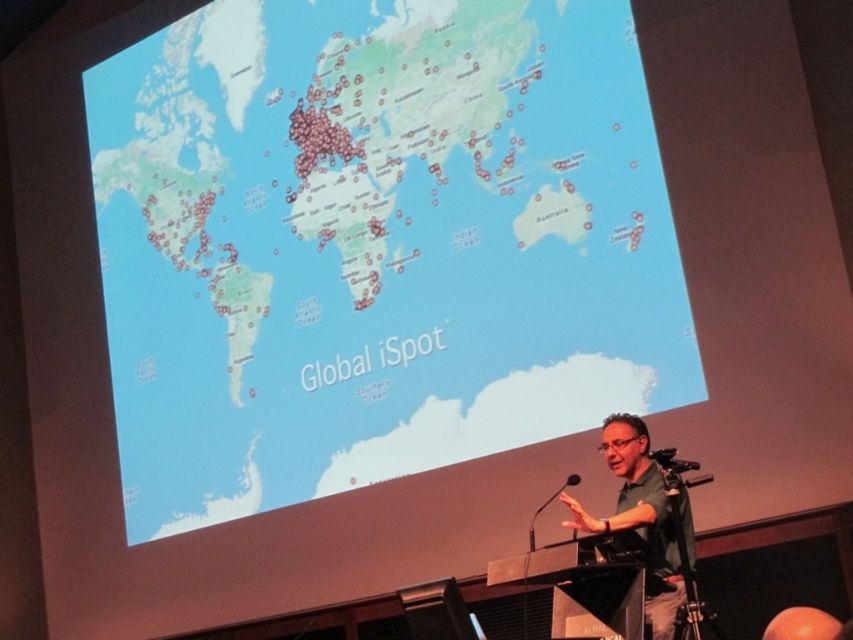
You are standing at the front of the room and need to adjust the volume of the black plastic speaker at lower center. Based on its position, where should you move to reach it?

The black plastic speaker at lower center is located at point [438,611], so you should move towards the lower center area of the room to reach it.

In the scene shown: You are an attendee at the presentation and want to ask a question. You need to walk from your seat to the podium. Which object, the green fabric shirt at lower right or the black plastic microphone at lower center, will you see first as you approach the podium from the audience side?

The green fabric shirt at lower right is positioned on the right side of the black plastic microphone at lower center, so you will see the black plastic microphone at lower center first as you approach the podium from the audience side.

You are an attendee at the presentation and want to move from your seat to the orange matte ball at lower right. Which direction should you walk relative to the black plastic speaker at lower center?

The black plastic speaker at lower center is to the left of the orange matte ball at lower right. So you should walk to the right of the black plastic speaker at lower center to reach the orange matte ball at lower right.